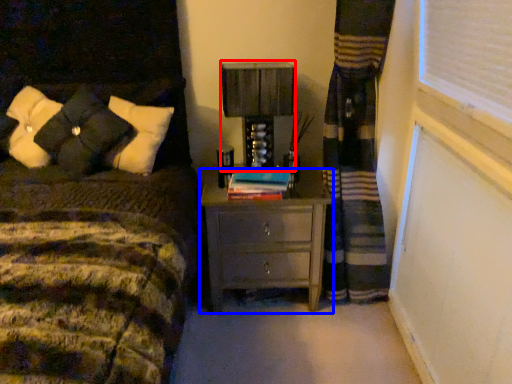
Question: Which object appears farthest to the camera in this image, table lamp (highlighted by a red box) or nightstand (highlighted by a blue box)?

Choices:
 (A) table lamp
 (B) nightstand

Answer: (A)